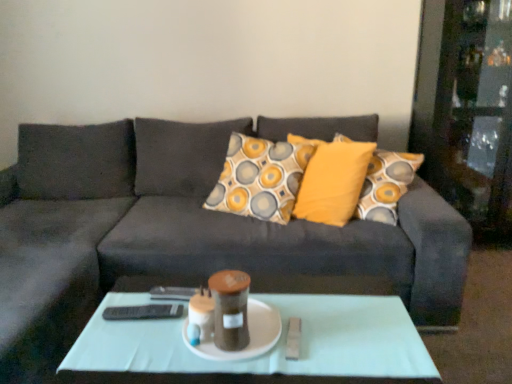
Question: From the image's perspective, relative to white ceramic plate at center, is light green glass coffee table at center above or below?

Choices:
 (A) below
 (B) above

Answer: (A)

Question: From their relative heights in the image, would you say light green glass coffee table at center is taller or shorter than white ceramic plate at center?

Choices:
 (A) tall
 (B) short

Answer: (A)

Question: Considering the real-world distances, which object is farthest from the white ceramic plate at center?

Choices:
 (A) dark gray fabric couch at center
 (B) light green glass coffee table at center
 (C) black plastic remote at center

Answer: (A)

Question: Considering the real-world distances, which object is closest to the light green glass coffee table at center?

Choices:
 (A) black plastic remote at center
 (B) dark gray fabric couch at center
 (C) white ceramic plate at center

Answer: (C)